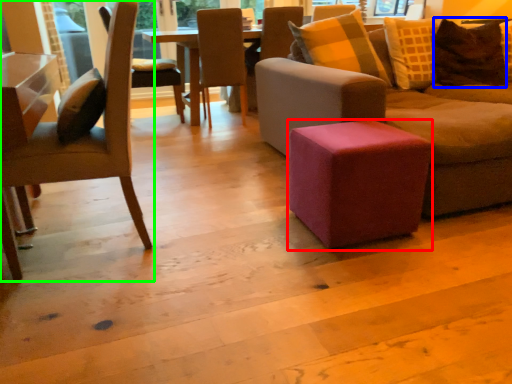
Question: Which is nearer to the stool (highlighted by a red box)? pillow (highlighted by a blue box) or chair (highlighted by a green box).

Choices:
 (A) pillow
 (B) chair

Answer: (B)